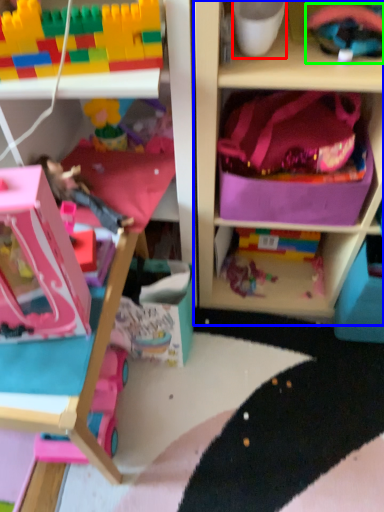
Question: Which object is positioned closest to coffee cup (highlighted by a red box)? Select from shelf (highlighted by a blue box) and toy (highlighted by a green box).

Choices:
 (A) shelf
 (B) toy

Answer: (B)